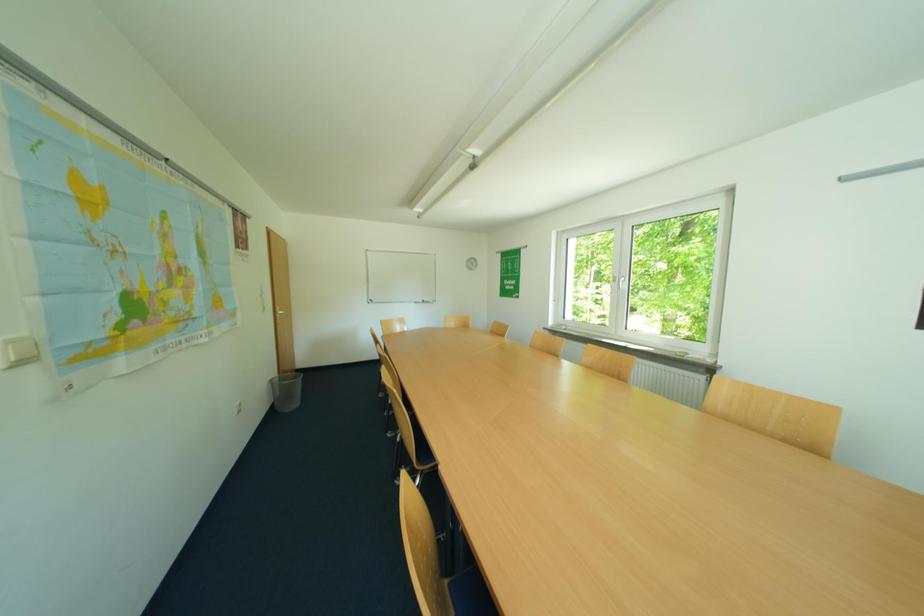
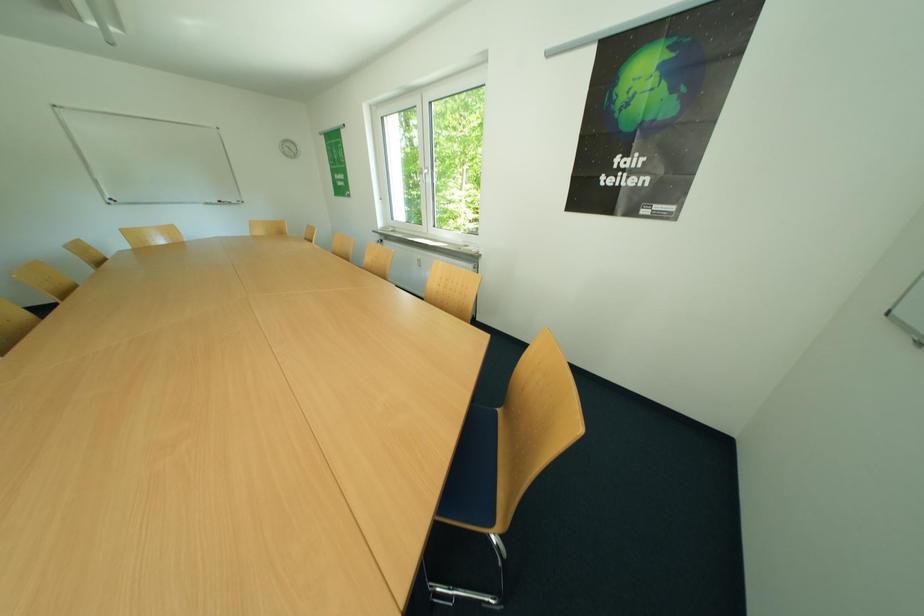
Question: What movement of the cameraman would produce the second image?

Choices:
 (A) Left
 (B) Right
 (C) Forward
 (D) Backward

Answer: (B)